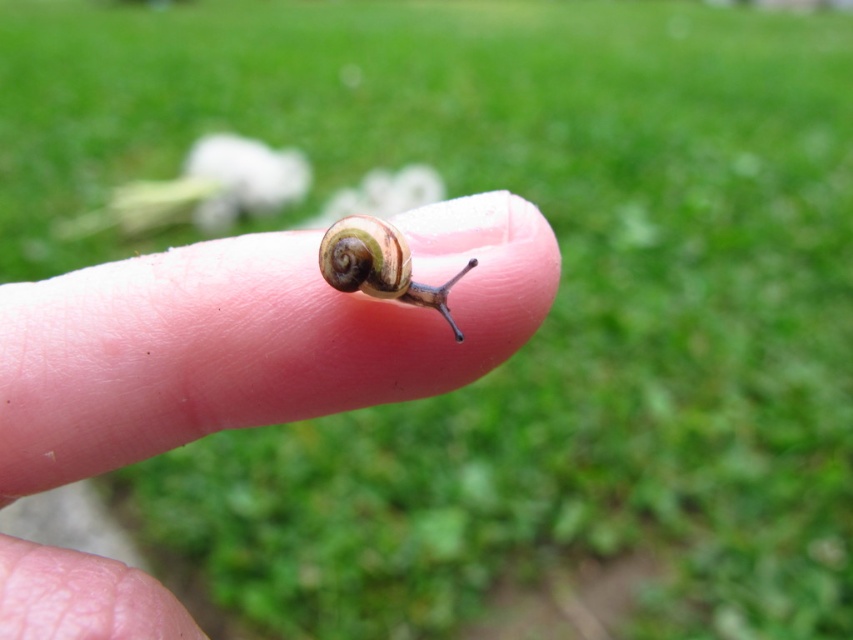
Is pink flesh at center positioned at the back of shiny brown snail at center?

No, pink flesh at center is in front of shiny brown snail at center.

Which is above, pink flesh at center or shiny brown snail at center?

shiny brown snail at center

This screenshot has height=640, width=853. Find the location of `pink flesh at center`. pink flesh at center is located at coordinates (251, 339).